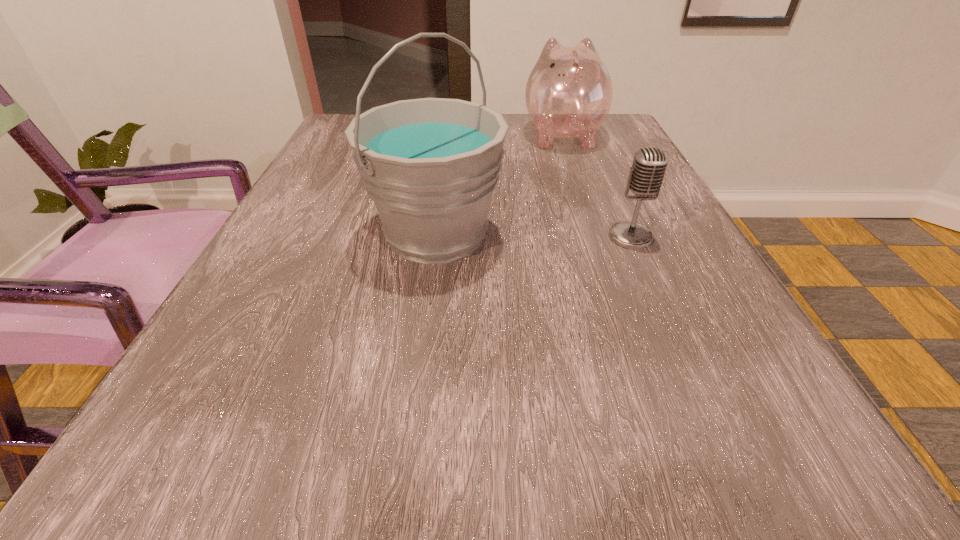
Identify the location of the leftmost object. (430, 165).

Image resolution: width=960 pixels, height=540 pixels. Find the location of `the tallest object`. the tallest object is located at coordinates (430, 165).

Where is `the second shortest object`? the second shortest object is located at coordinates tap(569, 91).

Where is `the farthest object`? The height and width of the screenshot is (540, 960). the farthest object is located at coordinates (569, 91).

Where is `microphone`? microphone is located at coordinates tap(646, 175).

Image resolution: width=960 pixels, height=540 pixels. I want to click on vacant space located 0.200m on the right of the bucket, so click(x=617, y=234).

You are a GUI agent. You are given a task and a screenshot of the screen. Output one action in this format:
    pyautogui.click(x=<x>, y=<y>)
    Task: Click on the vacant region located 0.320m on the back of the microphone
    This screenshot has height=540, width=960.
    Given the screenshot: What is the action you would take?
    click(x=591, y=148)

At what (x,y) coordinates should I click in order to perform the action: click on object positioned at the far edge. Please return your answer as a coordinate pair (x, y). This screenshot has height=540, width=960. Looking at the image, I should click on (569, 91).

Locate an element on the screen. This screenshot has width=960, height=540. piggy bank positioned at the right edge is located at coordinates (569, 91).

At what (x,y) coordinates should I click in order to perform the action: click on microphone located at the right edge. Please return your answer as a coordinate pair (x, y). Looking at the image, I should click on (646, 175).